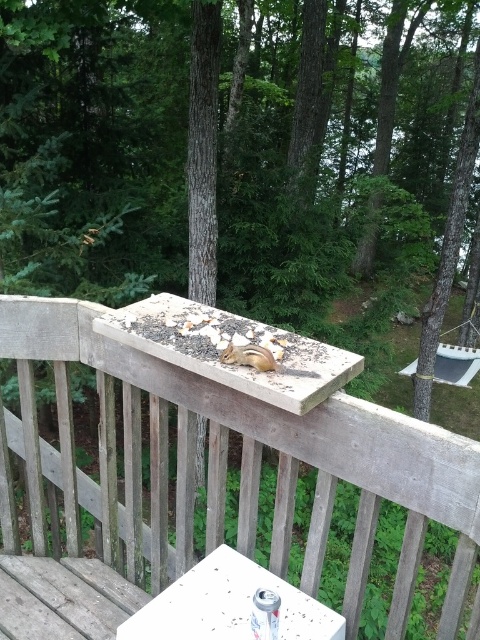
Is point (188, 625) farther from viewer compared to point (274, 368)?

Yes, it is behind point (274, 368).

This screenshot has width=480, height=640. In order to click on white plastic table at lower center in this screenshot , I will do `click(228, 604)`.

Based on the photo, is wooden rail at upper center thinner than gray fur squirrel at center?

In fact, wooden rail at upper center might be wider than gray fur squirrel at center.

Consider the image. Between wooden rail at upper center and gray fur squirrel at center, which one is positioned lower?

wooden rail at upper center

Between point (416, 513) and point (220, 355), which one is positioned behind?

The point (220, 355) is behind.

Where is `wooden rail at upper center`? wooden rail at upper center is located at coordinates (206, 483).

Which of these two, wooden rail at upper center or white plastic table at lower center, stands shorter?

Standing shorter between the two is white plastic table at lower center.

Measure the distance between wooden rail at upper center and camera.

wooden rail at upper center and camera are 3.66 feet apart.

The width and height of the screenshot is (480, 640). What are the coordinates of `wooden rail at upper center` in the screenshot? It's located at (206, 483).